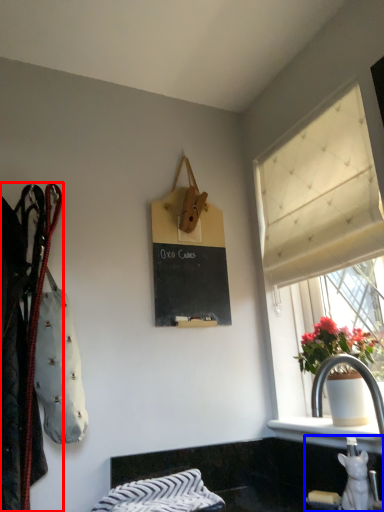
Question: Which point is further to the camera, closet (highlighted by a red box) or sink (highlighted by a blue box)?

Choices:
 (A) closet
 (B) sink

Answer: (B)